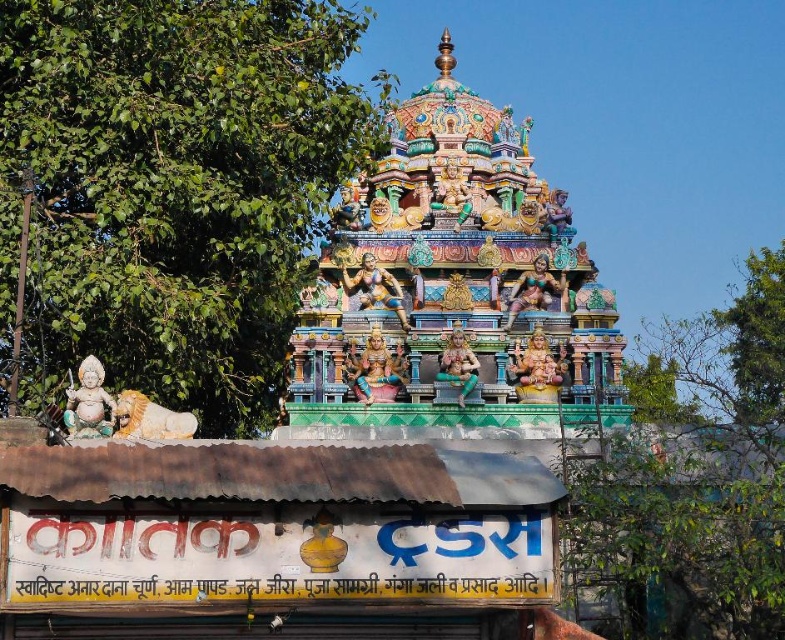
Does gold metallic statue at center appear on the right side of matte gold statue at center?

Correct, you'll find gold metallic statue at center to the right of matte gold statue at center.

Does gold metallic statue at center lie in front of matte gold statue at center?

No, gold metallic statue at center is behind matte gold statue at center.

Between point (393, 371) and point (312, 525), which one is positioned in front?

Point (312, 525) is more forward.

The image size is (785, 640). In order to click on gold metallic statue at center in this screenshot , I will do `click(375, 369)`.

Does stone statue at lower left have a lesser height compared to polished gold statue at center?

Correct, stone statue at lower left is not as tall as polished gold statue at center.

Is point (110, 413) more distant than point (451, 352)?

No.

Who is more distant from viewer, (x=101, y=410) or (x=451, y=339)?

The point (x=451, y=339) is more distant.

I want to click on stone statue at lower left, so click(x=88, y=403).

Can you confirm if green leafy tree at upper center is positioned above polished gold statue at center?

No.

You are a GUI agent. You are given a task and a screenshot of the screen. Output one action in this format:
    pyautogui.click(x=<x>, y=<y>)
    Task: Click on the green leafy tree at upper center
    
    Given the screenshot: What is the action you would take?
    pyautogui.click(x=696, y=480)